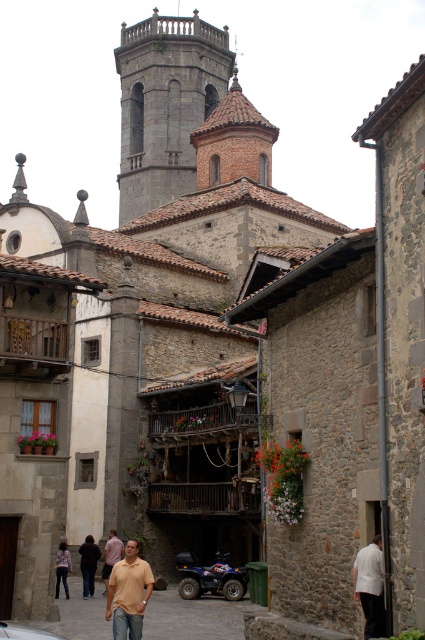
Which is in front, point (99, 611) or point (96, 560)?

Point (99, 611) is in front.

Does brown cotton shirt at lower left appear under dark brown leather jacket at lower left?

No.

Who is more distant from viewer, (141, 600) or (91, 540)?

Positioned behind is point (91, 540).

I want to click on brown cotton shirt at lower left, so click(113, 602).

Is beige cotton shirt at lower center to the left of metallic blue quad bike at center from the viewer's perspective?

Yes, beige cotton shirt at lower center is to the left of metallic blue quad bike at center.

Between beige cotton shirt at lower center and metallic blue quad bike at center, which one has less height?

With less height is metallic blue quad bike at center.

Locate an element on the screen. The height and width of the screenshot is (640, 425). beige cotton shirt at lower center is located at coordinates pyautogui.click(x=129, y=593).

Is light brown shirt at center bigger than denim pants at lower left?

Actually, light brown shirt at center might be smaller than denim pants at lower left.

Does point (113, 544) come in front of point (56, 564)?

That is False.

This screenshot has height=640, width=425. What are the coordinates of `light brown shirt at center` in the screenshot? It's located at (110, 556).